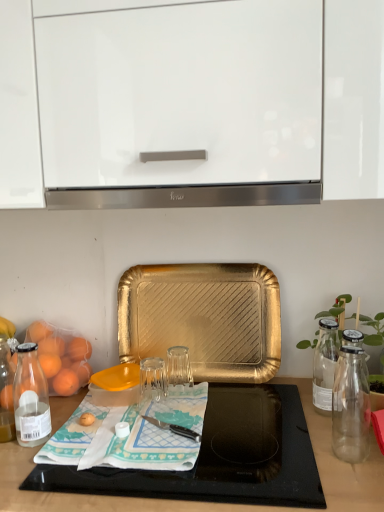
Question: Does transparent glass at center turn towards green glass bottle at right?

Choices:
 (A) no
 (B) yes

Answer: (A)

Question: Is transparent glass at center further to camera compared to green glass bottle at right?

Choices:
 (A) yes
 (B) no

Answer: (A)

Question: From a real-world perspective, is transparent glass at center positioned under green glass bottle at right based on gravity?

Choices:
 (A) no
 (B) yes

Answer: (B)

Question: Is transparent glass at center not inside green glass bottle at right?

Choices:
 (A) yes
 (B) no

Answer: (A)

Question: From the image's perspective, would you say transparent glass at center is positioned over green glass bottle at right?

Choices:
 (A) no
 (B) yes

Answer: (A)

Question: Can you confirm if transparent glass at center is shorter than green glass bottle at right?

Choices:
 (A) yes
 (B) no

Answer: (A)

Question: Is transparent plastic cutting board at lower center further to the viewer compared to transparent glass at center?

Choices:
 (A) no
 (B) yes

Answer: (A)

Question: Is transparent plastic cutting board at lower center in contact with transparent glass at center?

Choices:
 (A) no
 (B) yes

Answer: (A)

Question: From a real-world perspective, is transparent plastic cutting board at lower center over transparent glass at center?

Choices:
 (A) no
 (B) yes

Answer: (A)

Question: Can you confirm if transparent plastic cutting board at lower center is positioned to the right of transparent glass at center?

Choices:
 (A) yes
 (B) no

Answer: (A)

Question: Can you confirm if transparent plastic cutting board at lower center is wider than transparent glass at center?

Choices:
 (A) yes
 (B) no

Answer: (A)

Question: Is transparent plastic cutting board at lower center looking in the opposite direction of transparent glass at center?

Choices:
 (A) yes
 (B) no

Answer: (B)

Question: Does transparent glass at center have a lesser width compared to teal fabric placemat at center?

Choices:
 (A) no
 (B) yes

Answer: (B)